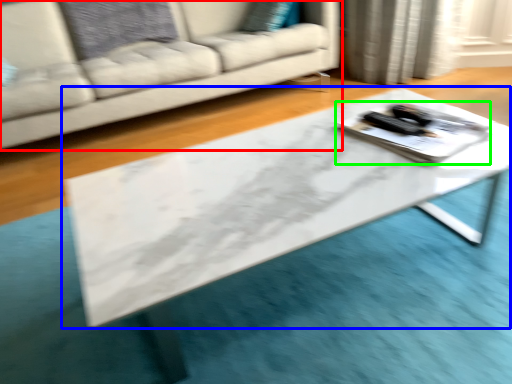
Question: Which object is positioned closest to studio couch (highlighted by a red box)? Select from table (highlighted by a blue box) and tray (highlighted by a green box).

Choices:
 (A) table
 (B) tray

Answer: (A)